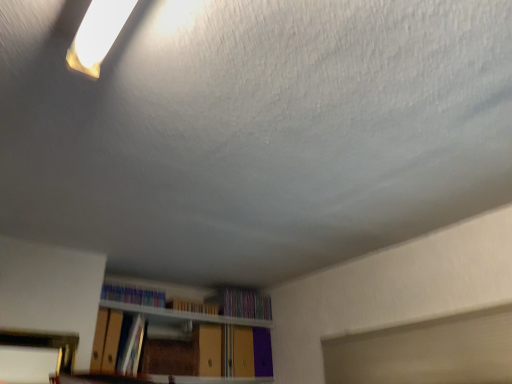
Question: Is hardcover book at center, which ranks as the 3th book in right-to-left order, spatially inside multicolored plastic books at upper center, which is the first book in left-to-right order, or outside of it?

Choices:
 (A) inside
 (B) outside

Answer: (B)

Question: From the image's perspective, is hardcover book at center, which is the second book from left to right, above or below multicolored plastic books at upper center, which is the first book in left-to-right order?

Choices:
 (A) above
 (B) below

Answer: (B)

Question: Which object is the closest to the hardcover book at center, which is the second book from left to right?

Choices:
 (A) hardcover book at center, the second book from the right
 (B) multicolored plastic books at upper center, which appears as the fourth book when viewed from the right
 (C) multicolored paper at center, marked as the 1th book in a right-to-left arrangement

Answer: (B)

Question: Based on their relative distances, which object is nearer to the multicolored plastic books at upper center, which is the first book in left-to-right order?

Choices:
 (A) hardcover book at center, which ranks as the 3th book in right-to-left order
 (B) hardcover book at center, which is the 3th book from left to right
 (C) multicolored paper at center, marked as the 1th book in a right-to-left arrangement

Answer: (A)